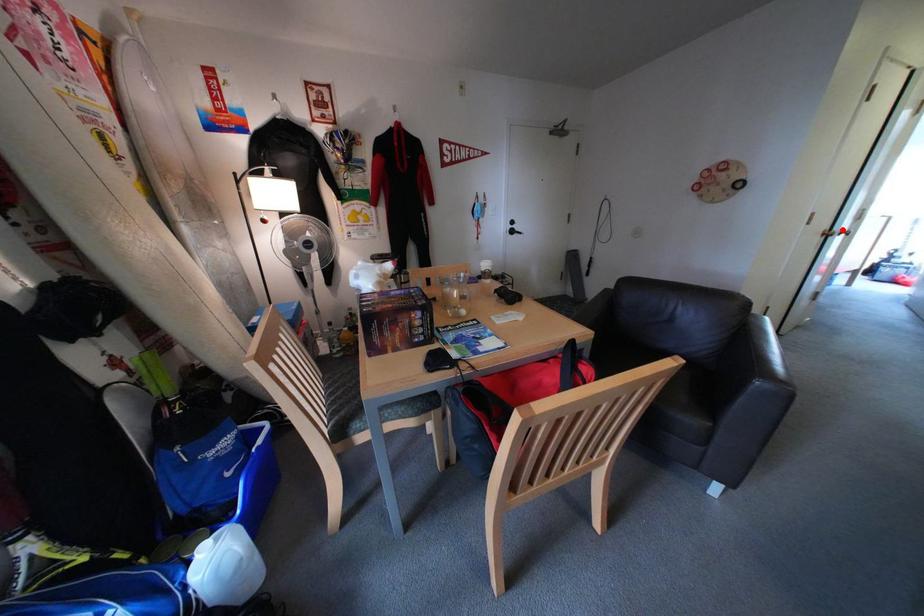
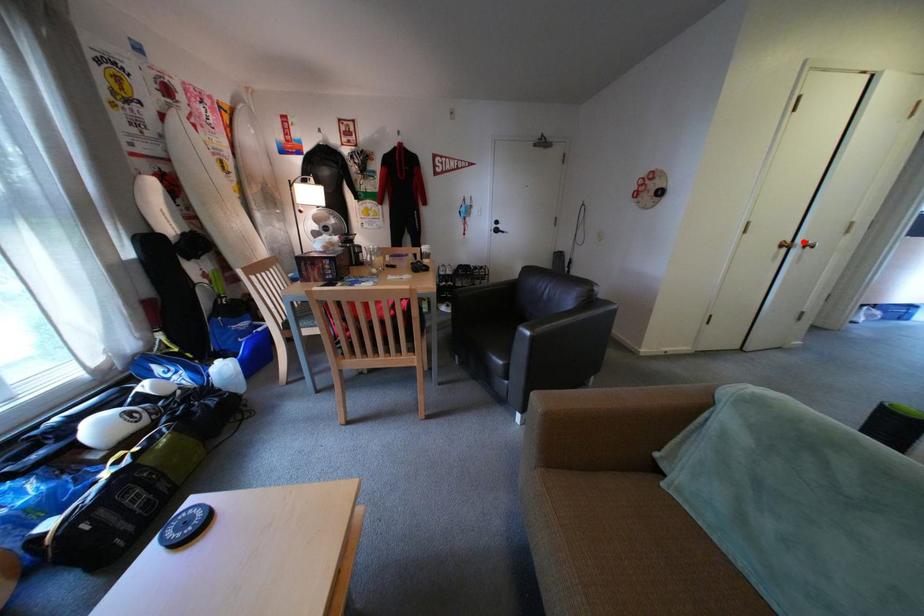
I am providing you with two images of the same scene from different viewpoints. A red point is marked on the first image and another point is marked on the second image. Does the point marked in image1 correspond to the same location as the one in image2?

Yes